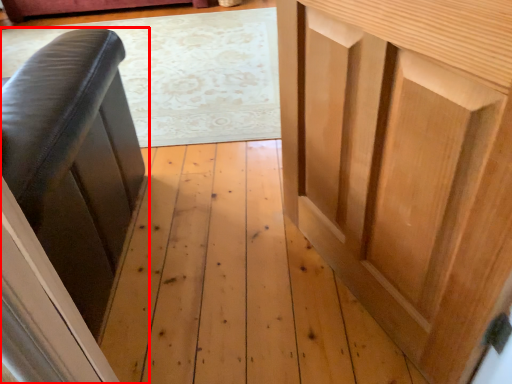
Question: From the image's perspective, where is furniture (annotated by the red box) located in relation to cupboard in the image?

Choices:
 (A) below
 (B) above

Answer: (B)